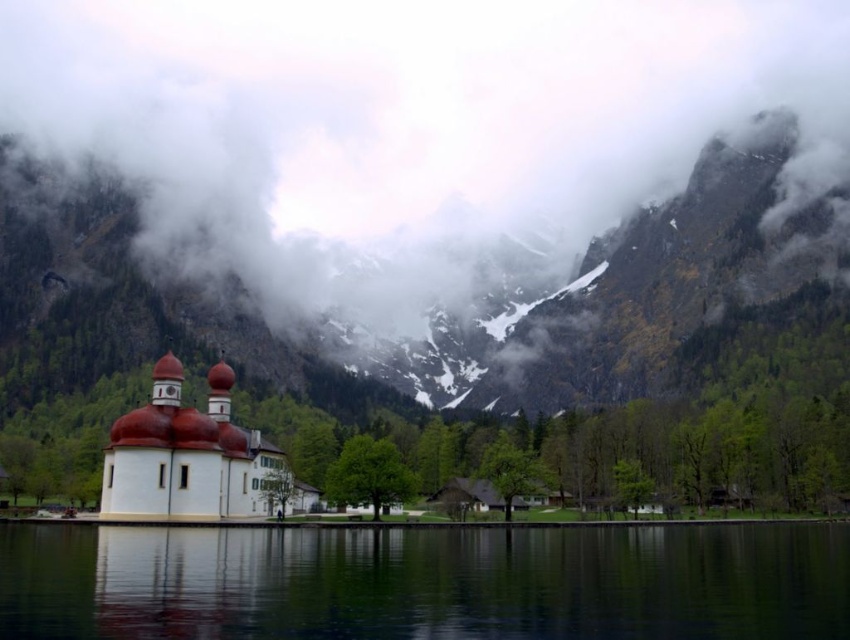
Which of these two, cloudy fog at upper center or transparent glass water at center, stands shorter?

Standing shorter between the two is transparent glass water at center.

Image resolution: width=850 pixels, height=640 pixels. What do you see at coordinates (414, 122) in the screenshot?
I see `cloudy fog at upper center` at bounding box center [414, 122].

Find the location of a particular element. cloudy fog at upper center is located at coordinates (414, 122).

Image resolution: width=850 pixels, height=640 pixels. Identify the location of cloudy fog at upper center. (414, 122).

Who is more distant from viewer, (x=621, y=17) or (x=129, y=448)?

The point (x=621, y=17) is behind.

You are a GUI agent. You are given a task and a screenshot of the screen. Output one action in this format:
    pyautogui.click(x=<x>, y=<y>)
    Task: Click on the cloudy fog at upper center
    The width and height of the screenshot is (850, 640).
    Given the screenshot: What is the action you would take?
    pyautogui.click(x=414, y=122)

Who is taller, transparent glass water at center or white matte church at center?

With more height is white matte church at center.

Can you confirm if transparent glass water at center is smaller than white matte church at center?

No.

Locate an element on the screen. transparent glass water at center is located at coordinates [x=425, y=582].